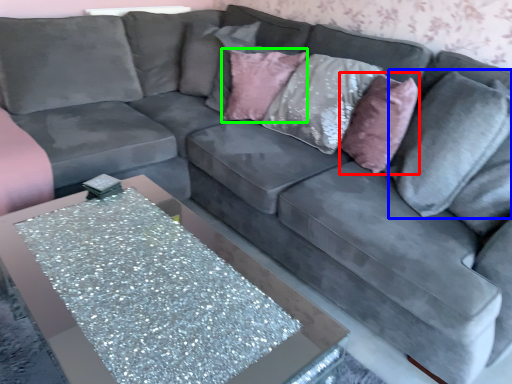
Question: Based on their relative distances, which object is nearer to throw pillow (highlighted by a red box)? Choose from pillow (highlighted by a blue box) and pillow (highlighted by a green box).

Choices:
 (A) pillow
 (B) pillow

Answer: (A)